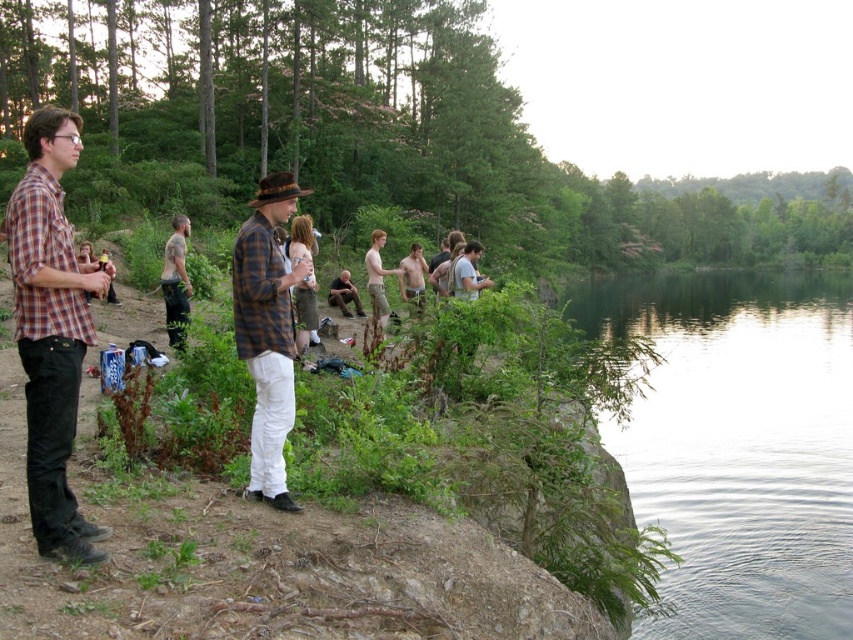
You are a photographer trying to capture a shot of both the plaid fabric shirt at center and the brown leather jacket at center. Since you want to include both subjects in the frame, which direction should you move your camera to ensure both are visible?

Since the plaid fabric shirt at center is to the right of the brown leather jacket at center, you should move your camera slightly to the left to ensure both are visible in the frame.

You are a photographer trying to capture a photo of the plaid fabric shirt at center and the light brown cotton shorts at center. Since you want to include both in the frame, which direction should you move your camera to the left or right to ensure both are visible?

The plaid fabric shirt at center is to the right of the light brown cotton shorts at center. To include both in the frame, you should move your camera to the left so that the leftmost object, the light brown cotton shorts at center, stays in view while the plaid fabric shirt at center remains on the right side.

Based on the coordinates provided, which object is located at point (267, 332) in the image?

The point (267, 332) corresponds to the plaid fabric shirt at center.